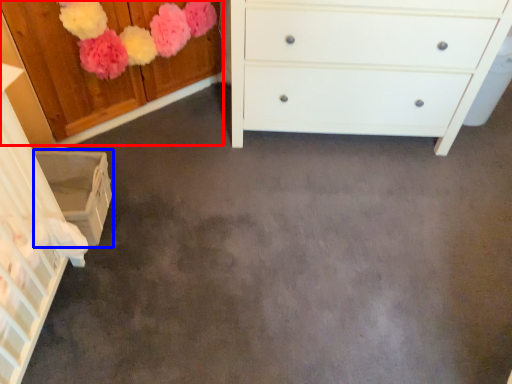
Question: Which of the following is the closest to the observer, cabinetry (highlighted by a red box) or cabinetry (highlighted by a blue box)?

Choices:
 (A) cabinetry
 (B) cabinetry

Answer: (A)